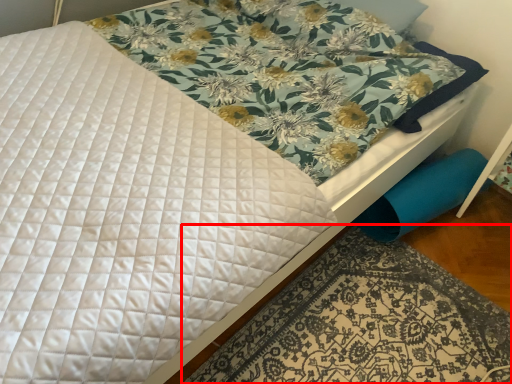
Question: From the image's perspective, considering the relative positions of mat (annotated by the red box) and swivel chair in the image provided, where is mat (annotated by the red box) located with respect to the staircase?

Choices:
 (A) below
 (B) above

Answer: (A)